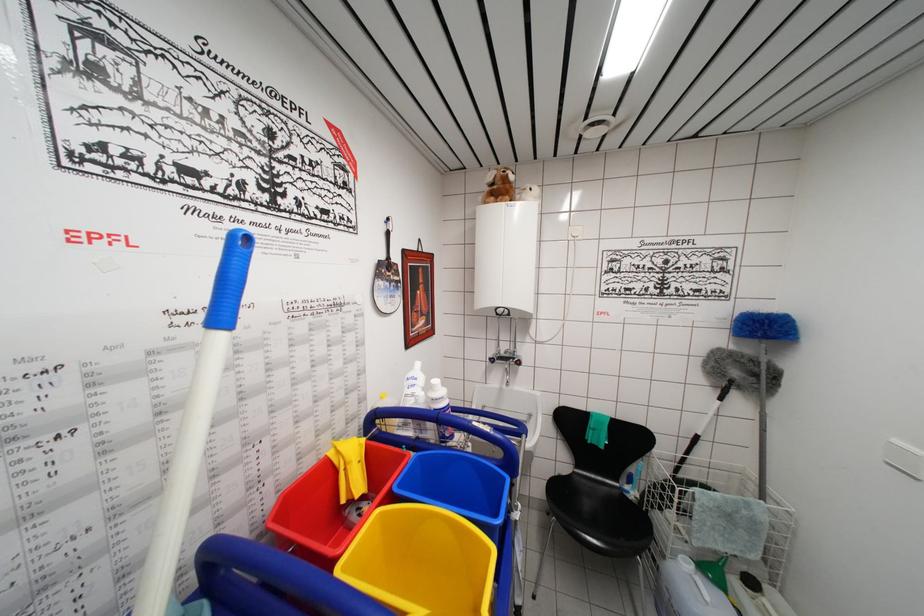
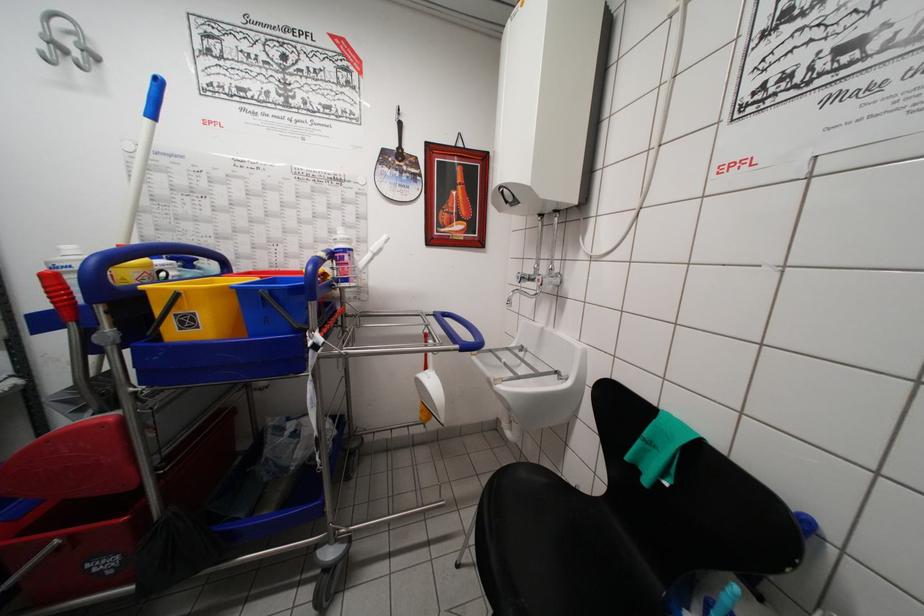
Find the pixel in the second image that matches the point at 319,415 in the first image.

(319, 252)